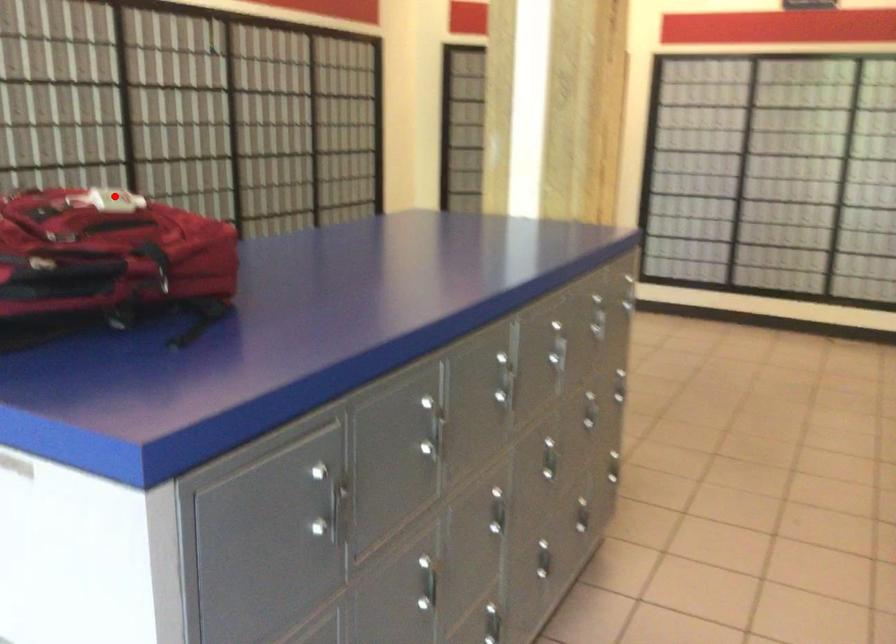
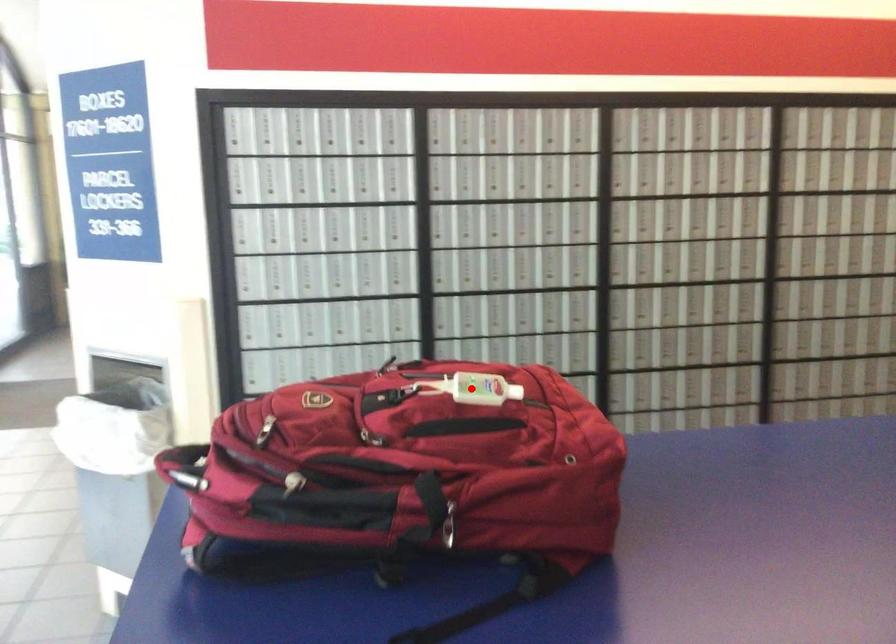
I am providing you with two images of the same scene from different viewpoints. A red point is marked on the first image and another point is marked on the second image. Does the point marked in image1 correspond to the same location as the one in image2?

Yes